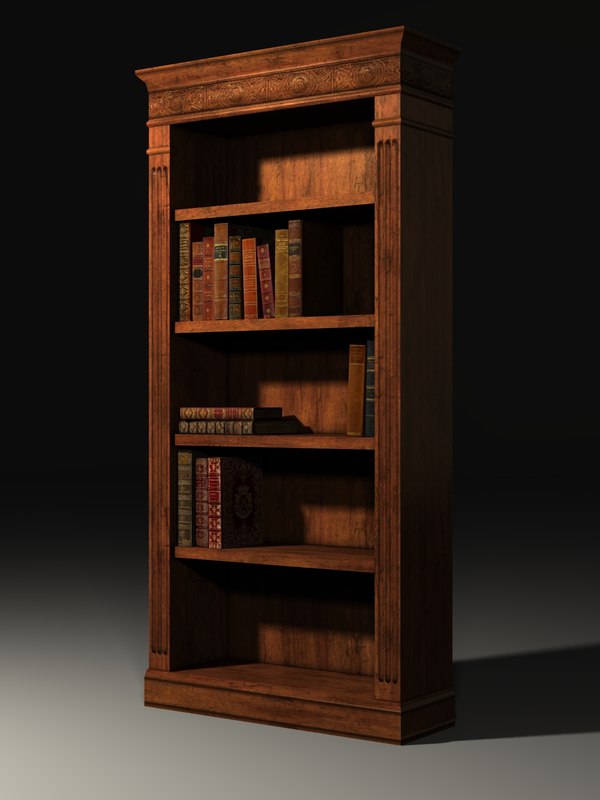
Where is `engraved decorations`? engraved decorations is located at coordinates (181, 101), (242, 93), (301, 78), (382, 68), (388, 536), (163, 534).